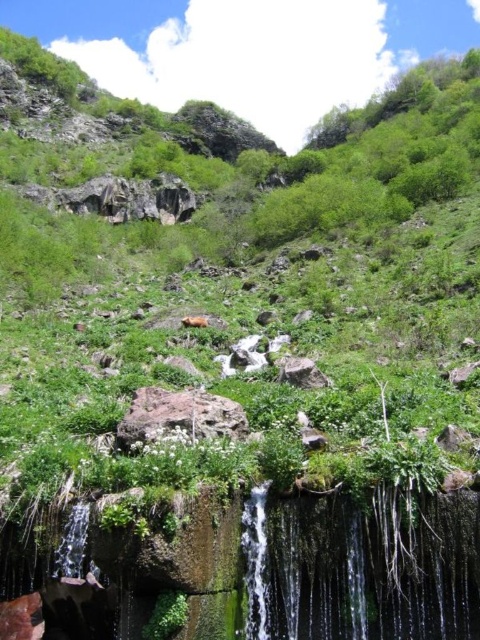
Question: Is clear water at center below rusty rock at center?

Choices:
 (A) no
 (B) yes

Answer: (B)

Question: Does clear water at center appear under rusty rock at center?

Choices:
 (A) yes
 (B) no

Answer: (A)

Question: Can you confirm if clear water at center is thinner than rusty rock at center?

Choices:
 (A) no
 (B) yes

Answer: (B)

Question: Which point is closer to the camera taking this photo?

Choices:
 (A) (324, 611)
 (B) (206, 406)

Answer: (A)

Question: Which point is closer to the camera taking this photo?

Choices:
 (A) (372, 573)
 (B) (162, 410)

Answer: (A)